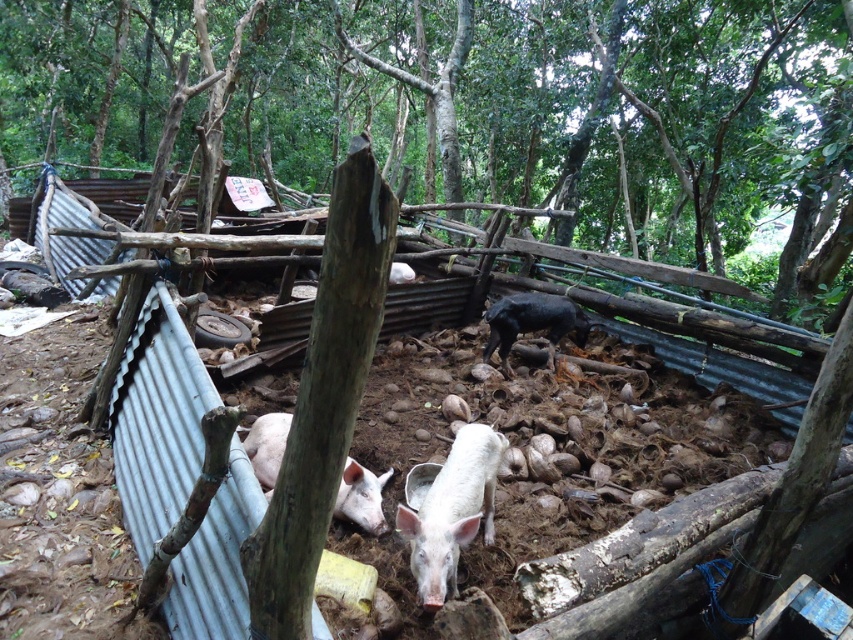
From the picture: You are standing in front of the pigsty and see the white matte pig at lower left and the shiny black pig at center. Which pig is positioned more to the left?

The white matte pig at lower left is positioned more to the left than the shiny black pig at center.